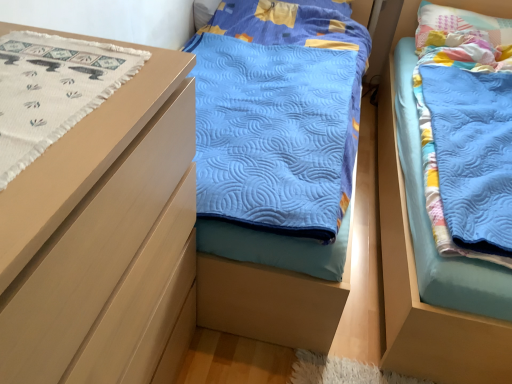
Question: Is blue quilted blanket at right to the left of pastel patchwork pillow at upper right from the viewer's perspective?

Choices:
 (A) no
 (B) yes

Answer: (B)

Question: Can you confirm if blue quilted blanket at right is positioned to the right of pastel patchwork pillow at upper right?

Choices:
 (A) yes
 (B) no

Answer: (B)

Question: From a real-world perspective, is blue quilted blanket at right over pastel patchwork pillow at upper right?

Choices:
 (A) no
 (B) yes

Answer: (A)

Question: Is blue quilted blanket at right oriented towards pastel patchwork pillow at upper right?

Choices:
 (A) yes
 (B) no

Answer: (B)

Question: Is blue quilted blanket at right facing away from pastel patchwork pillow at upper right?

Choices:
 (A) no
 (B) yes

Answer: (B)

Question: Relative to white woven fabric at left, is matte wood chest of drawers at left in front or behind?

Choices:
 (A) front
 (B) behind

Answer: (A)

Question: Is point (108, 334) positioned closer to the camera than point (106, 46)?

Choices:
 (A) closer
 (B) farther

Answer: (A)

Question: Considering the positions of matte wood chest of drawers at left and white woven fabric at left in the image, is matte wood chest of drawers at left taller or shorter than white woven fabric at left?

Choices:
 (A) tall
 (B) short

Answer: (A)

Question: Is matte wood chest of drawers at left inside the boundaries of white woven fabric at left, or outside?

Choices:
 (A) inside
 (B) outside

Answer: (B)

Question: Is blue quilted blanket at right taller or shorter than matte wood chest of drawers at left?

Choices:
 (A) short
 (B) tall

Answer: (A)

Question: Is blue quilted blanket at right in front of or behind matte wood chest of drawers at left in the image?

Choices:
 (A) behind
 (B) front

Answer: (A)

Question: From the image's perspective, is blue quilted blanket at right positioned above or below matte wood chest of drawers at left?

Choices:
 (A) below
 (B) above

Answer: (B)

Question: From a real-world perspective, is blue quilted blanket at right above or below matte wood chest of drawers at left?

Choices:
 (A) below
 (B) above

Answer: (A)

Question: In terms of size, does matte wood chest of drawers at left appear bigger or smaller than blue quilted blanket at right?

Choices:
 (A) small
 (B) big

Answer: (A)

Question: Is matte wood chest of drawers at left in front of or behind blue quilted blanket at right in the image?

Choices:
 (A) behind
 (B) front

Answer: (B)